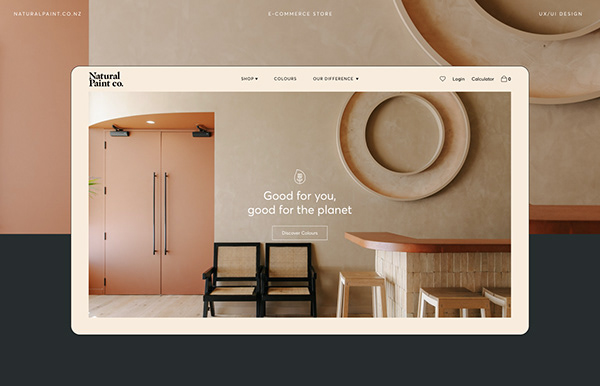
At what (x,y) coordinates should I click in order to perform the action: click on stools. Please return your answer as a coordinate pair (x, y). This screenshot has width=600, height=386. Looking at the image, I should click on (370, 281), (433, 304), (495, 296).